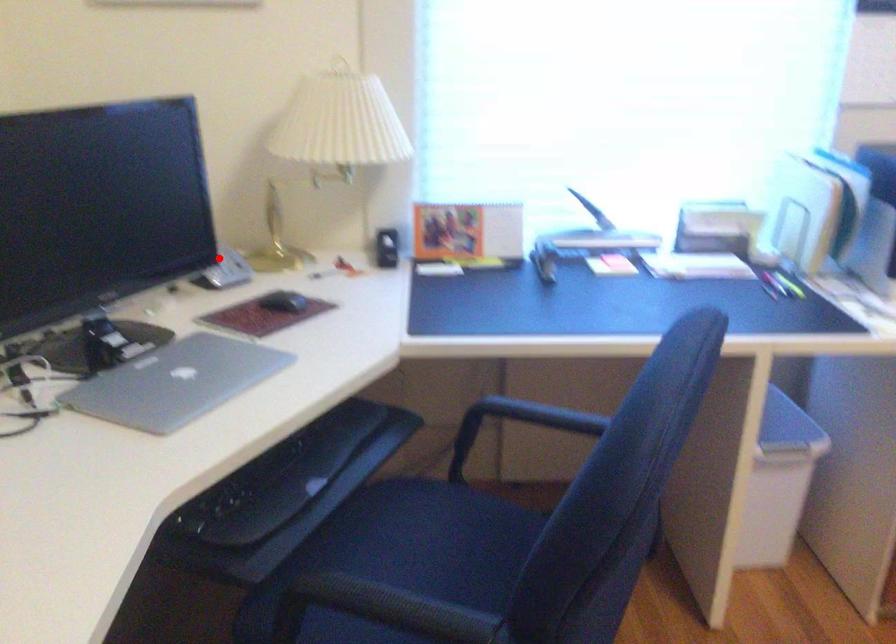
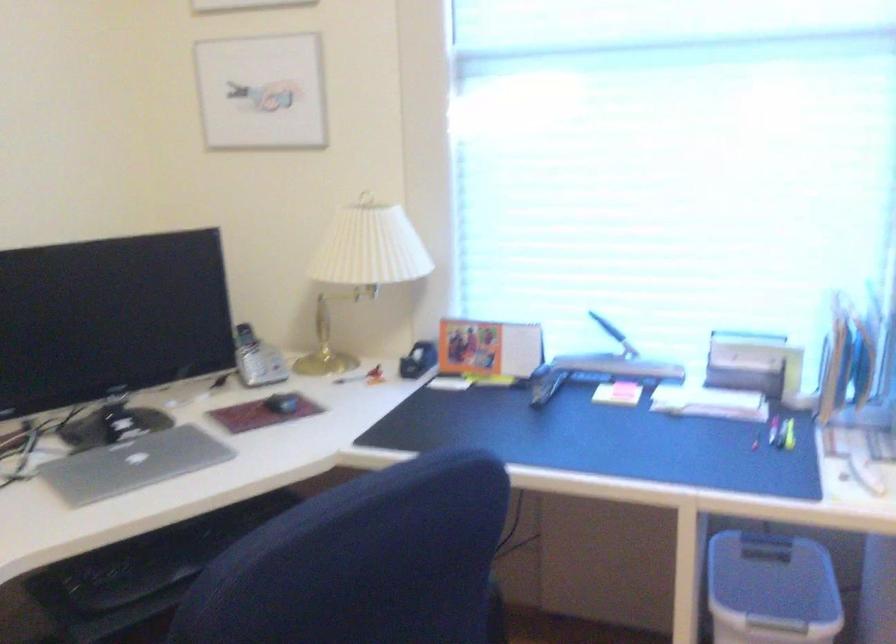
Question: A red point is marked in image1. In image2, is the corresponding 3D point closer to the camera or farther? Reply with the corresponding letter.

Choices:
 (A) The corresponding 3D point is closer.
 (B) The corresponding 3D point is farther.

Answer: (B)